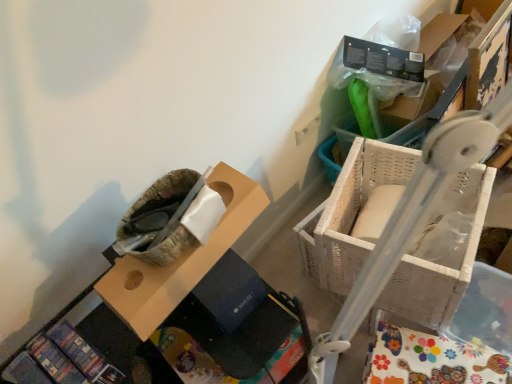
Question: Should I look upward or downward to see white wicker basket at lower right?

Choices:
 (A) down
 (B) up

Answer: (A)